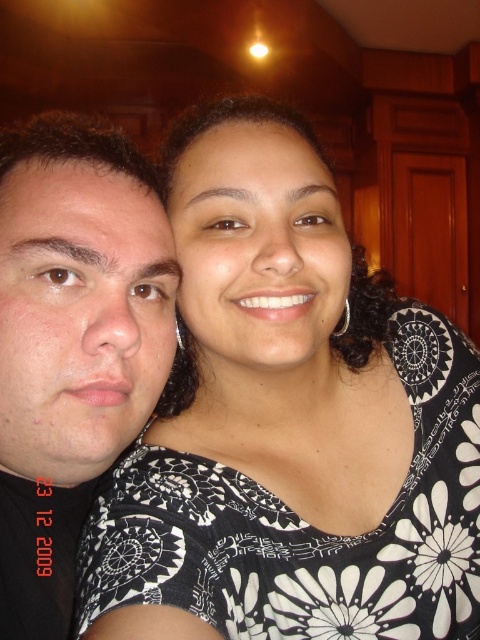
Looking at this image, you are a photographer trying to capture a clear shot of both the black floral dress at center and the matte black face at left. Since you want to ensure both are visible, which object should you focus on first to account for their sizes?

The black floral dress at center is bigger than the matte black face at left. Therefore, you should focus on the black floral dress at center first because it occupies more space in the frame, ensuring it is in sharp focus before adjusting for the smaller matte black face at left.

You are a photographer setting up a shoot in the room described. You need to ensure that the black floral dress at center and the matte black face at left are both visible in the frame. Given their height difference, which object should you adjust the camera angle to focus on first to capture both effectively?

The black floral dress at center is taller than the matte black face at left. To capture both effectively, adjust the camera angle to focus on the taller black floral dress at center first, then ensure the shorter matte black face at left is within the frame.

You are a photographer trying to capture a closeup of the matte black face at left without including the black floral dress at center in the frame. Based on their positions, is this possible?

The black floral dress at center is to the right of matte black face at left, so if you position the camera to focus solely on the matte black face at left while avoiding the area to its right, it should be possible to exclude the black floral dress at center from the frame.